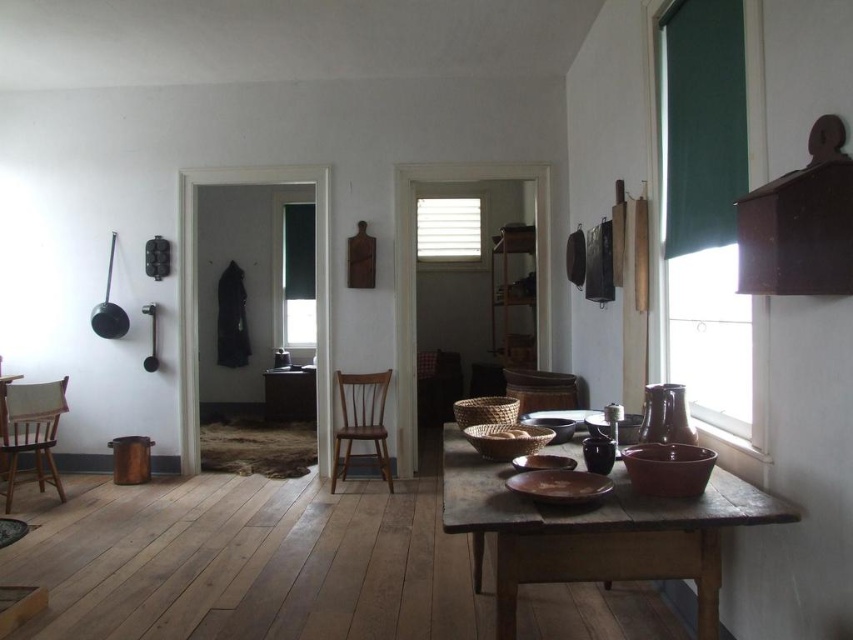
Is the position of wooden chair at lower left less distant than that of white textured blinds at center?

Yes, it is.

Is point (36, 432) positioned before point (422, 205)?

That is True.

Locate an element on the screen. This screenshot has width=853, height=640. wooden chair at lower left is located at coordinates (30, 429).

Can you confirm if green fabric window at right is positioned to the left of wooden table at center?

In fact, green fabric window at right is to the right of wooden table at center.

Is green fabric window at right smaller than wooden table at center?

No, green fabric window at right is not smaller than wooden table at center.

Who is more distant from viewer, (740, 84) or (288, 381)?

A: The point (288, 381) is behind.

Find the location of `green fabric window at right`. green fabric window at right is located at coordinates (711, 209).

Which is more to the left, brown wooden table at lower right or wooden chair at lower left?

Positioned to the left is wooden chair at lower left.

What do you see at coordinates (595, 532) in the screenshot? The width and height of the screenshot is (853, 640). I see `brown wooden table at lower right` at bounding box center [595, 532].

At what (x,y) coordinates should I click in order to perform the action: click on brown wooden table at lower right. Please return your answer as a coordinate pair (x, y). Looking at the image, I should click on (595, 532).